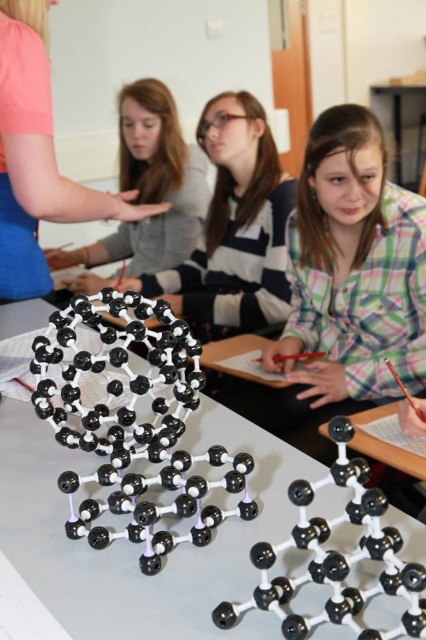
You are a student in the classroom looking at the pink fabric at upper left and the black plastic table at center. Which object is taller?

The pink fabric at upper left is taller than the black plastic table at center.